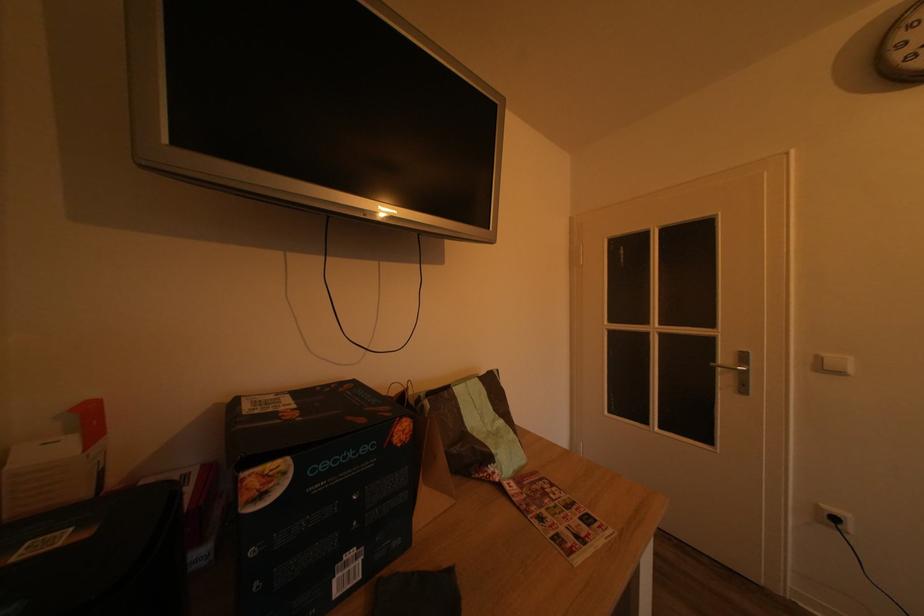
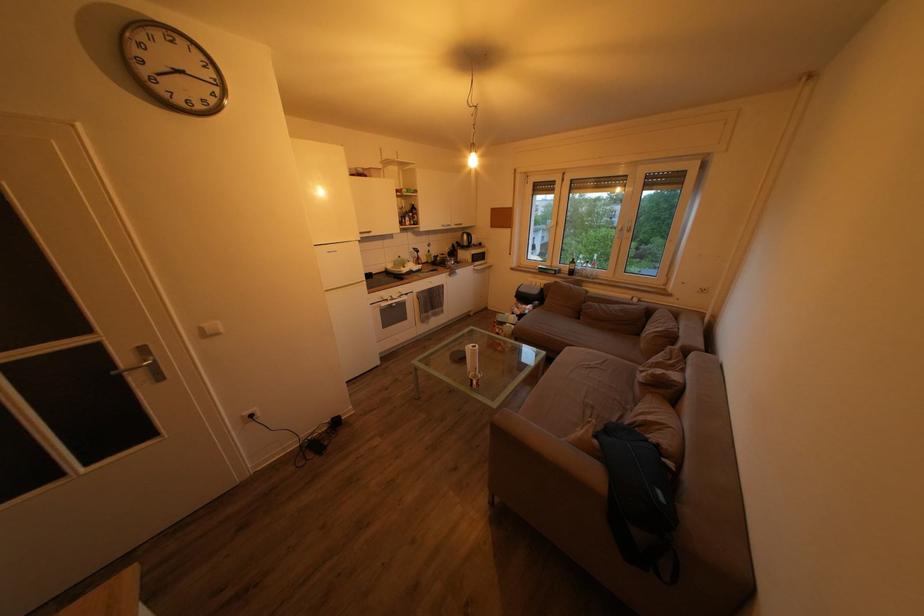
Where in the second image is the point corresponding to point 749,363 from the first image?

(151, 357)